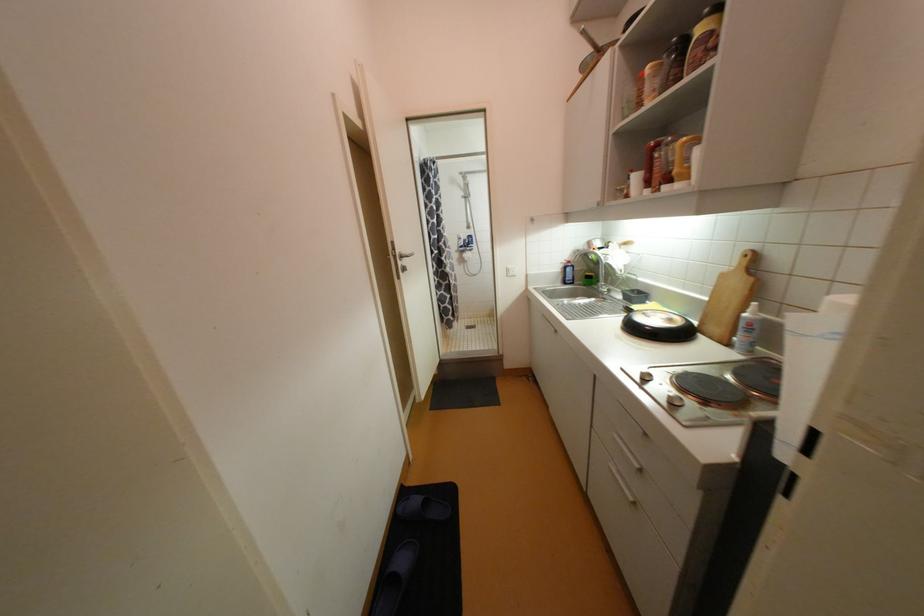
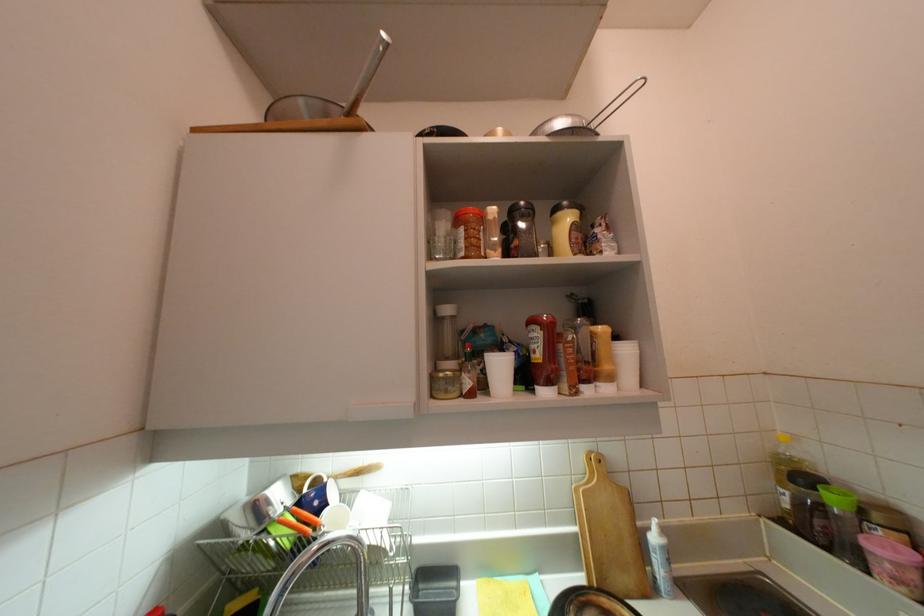
Where in the second image is the point corresponding to point 750,315 from the first image?

(660, 540)